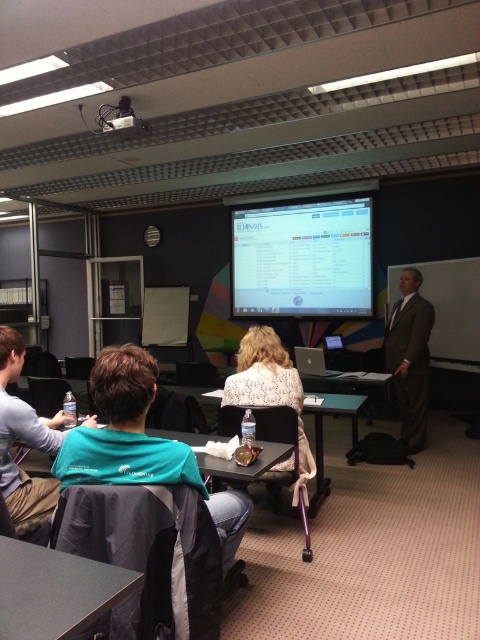
You are standing at the entrance of the classroom and want to locate the person wearing the teal fabric shirt at center. According to the grid system where the bottom left corner is the origin point, where would you find this individual?

The teal fabric shirt at center is located at the 2D coordinates point (143, 449).

Based on the photo, you are standing at the entrance of the classroom and want to locate the white textured blouse at center. Based on the coordinates provided, in which general direction should you look to find it?

The white textured blouse at center is located at coordinates point (269, 388), so you should look towards the center of the classroom slightly to the right and middle area.

You are a photographer setting up for a group photo in the classroom. You need to ensure that the white textured blouse at center and the black plastic table at center are both visible in the frame. Which object should you focus on first to ensure both are in focus?

The white textured blouse at center is larger than the black plastic table at center, so focusing on the larger object first would help ensure both are in focus.